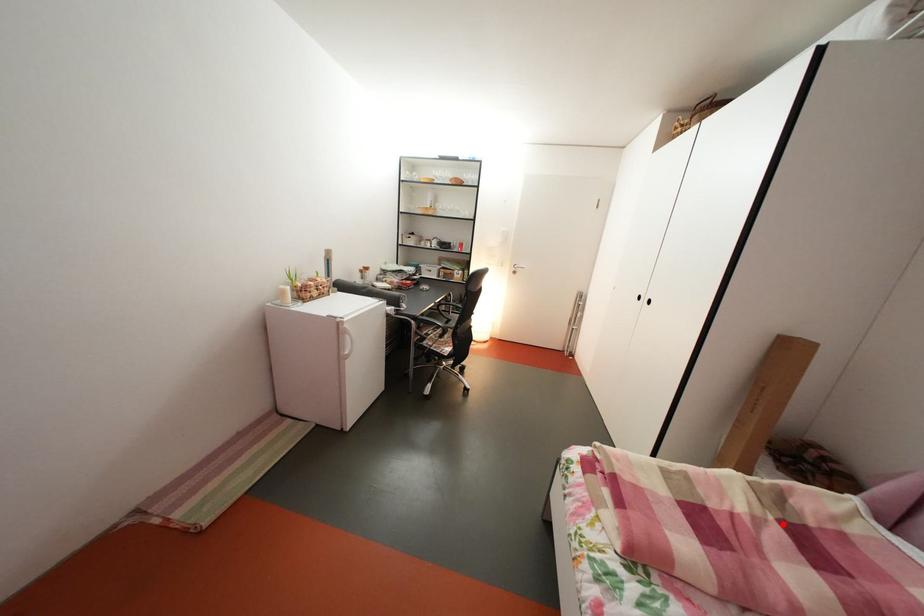
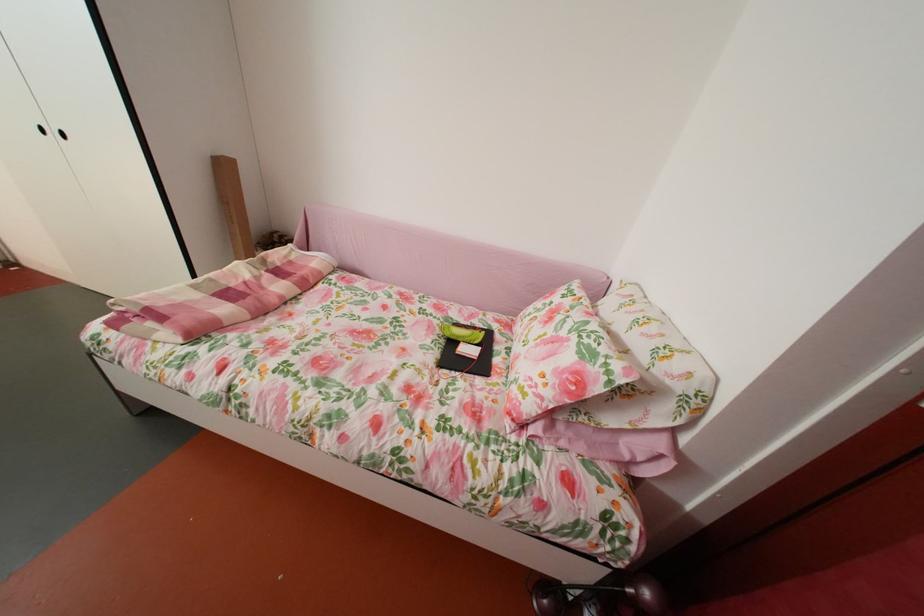
Find the pixel in the second image that matches the highlighted location in the first image.

(274, 278)